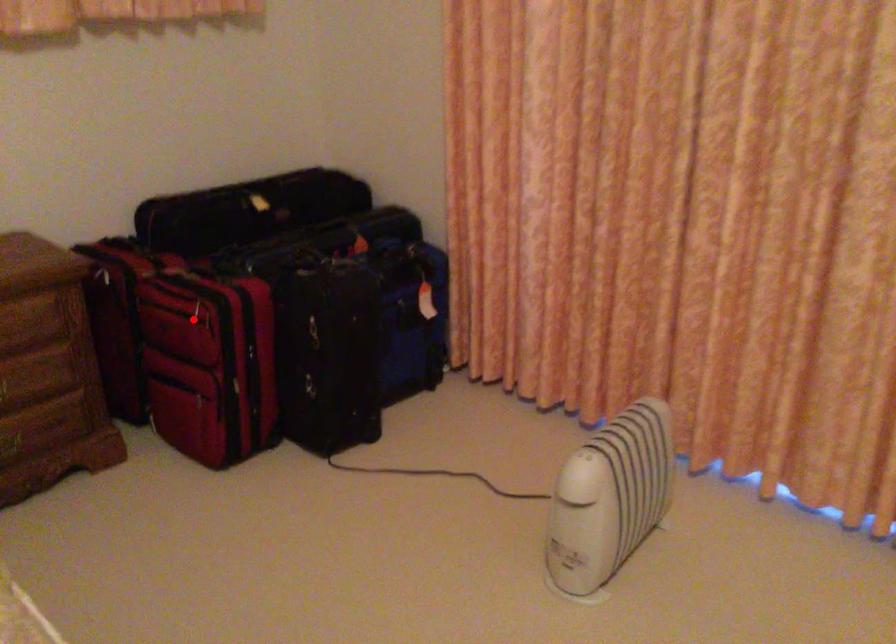
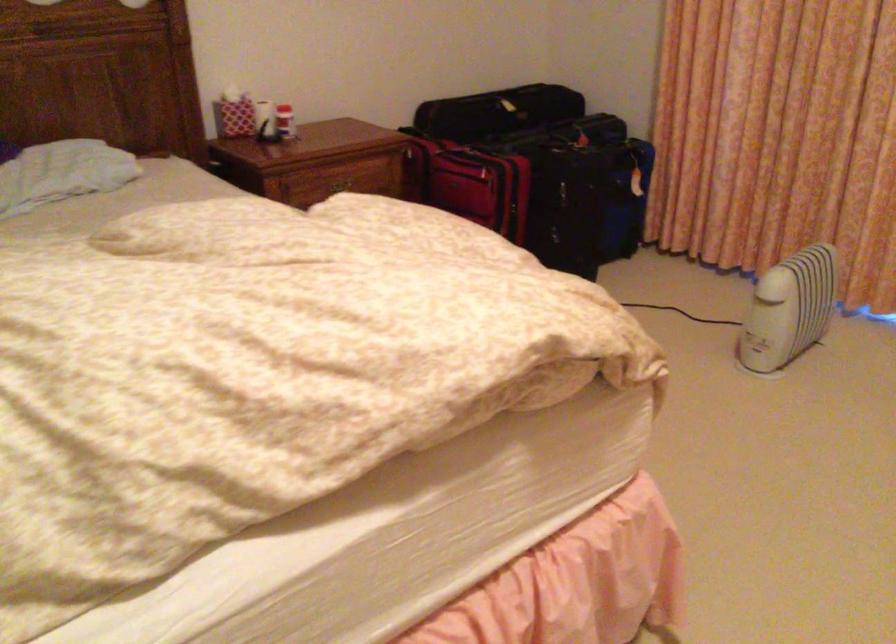
Question: I am providing you with two images of the same scene from different viewpoints. In image1, a red point is highlighted. Considering the same 3D point in image2, which of the following is correct?

Choices:
 (A) It is closer
 (B) It is farther

Answer: (B)